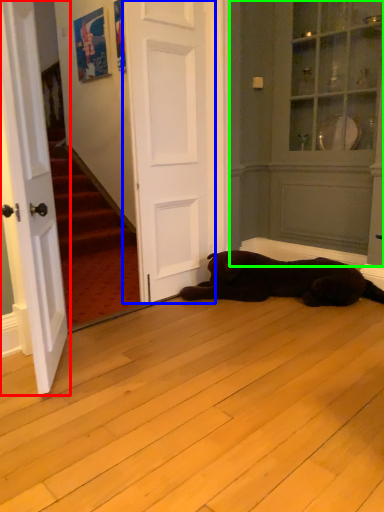
Question: Which is farther away from door (highlighted by a red box)? door (highlighted by a blue box) or armoire (highlighted by a green box)?

Choices:
 (A) door
 (B) armoire

Answer: (B)